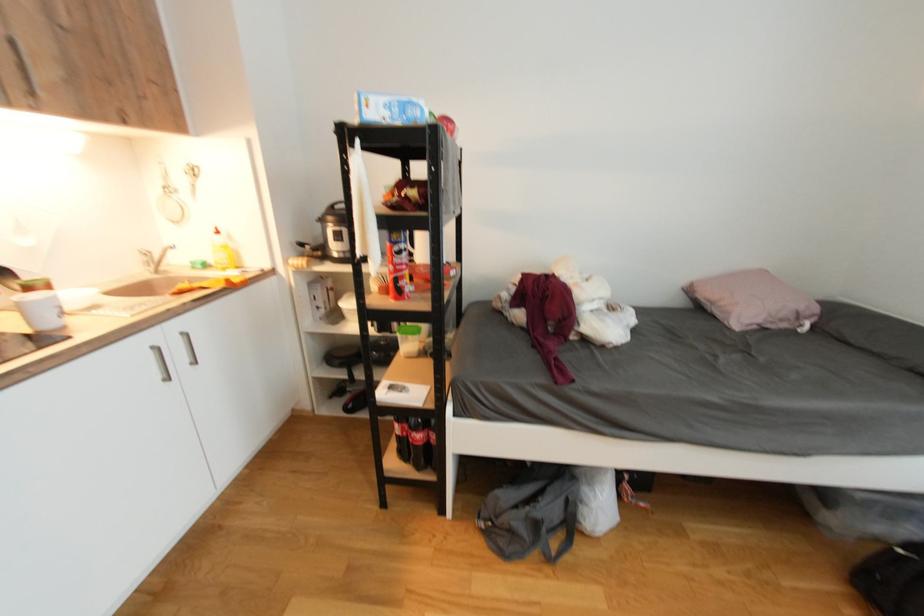
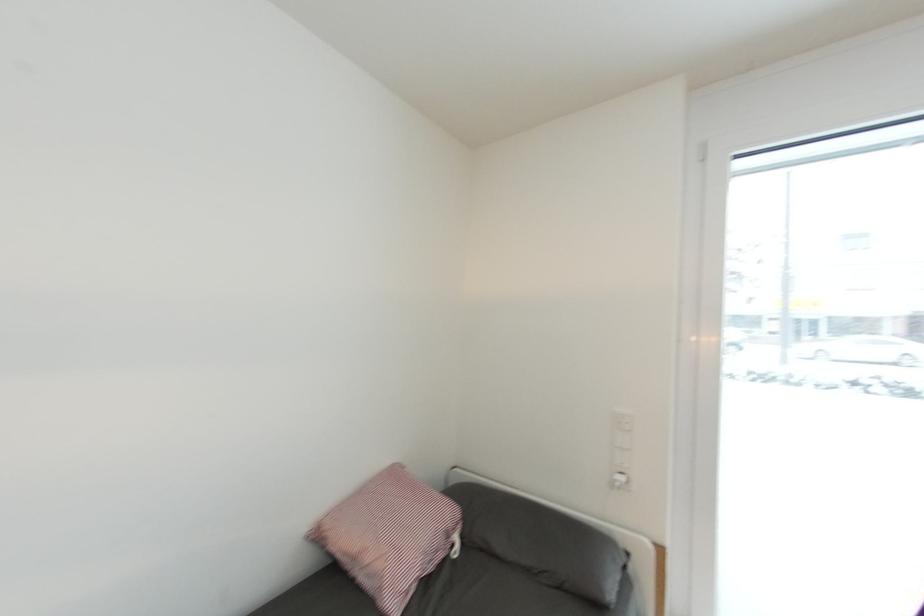
Question: How did the camera likely rotate?

Choices:
 (A) Left
 (B) Right
 (C) Up
 (D) Down

Answer: (B)